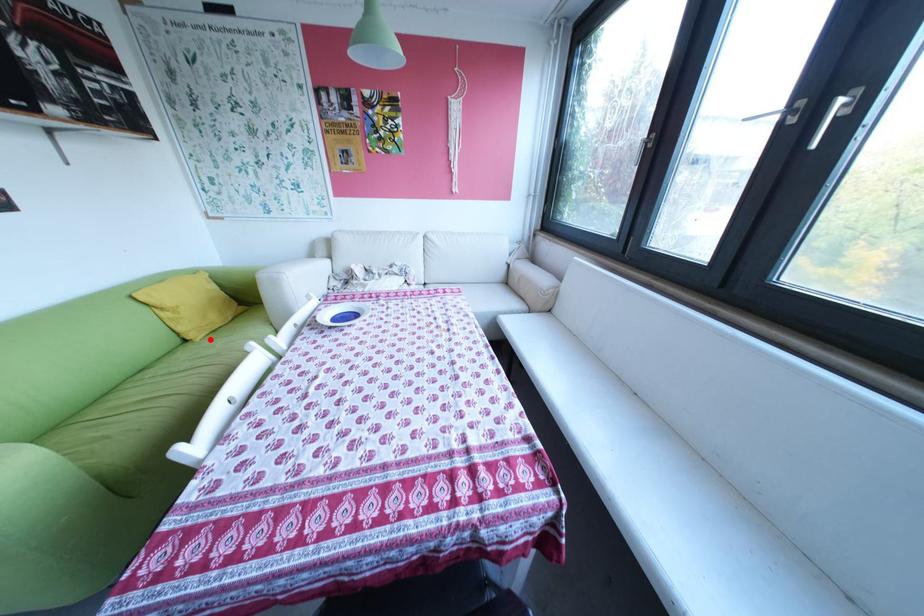
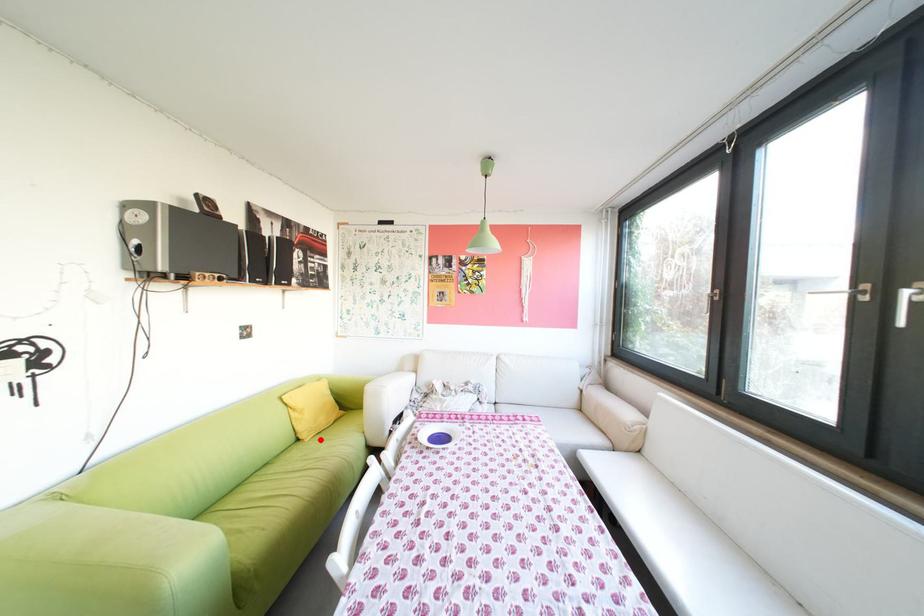
I am providing you with two images of the same scene from different viewpoints. A red point is marked on the first image and another point is marked on the second image. Is the marked point in image1 the same physical position as the marked point in image2?

Yes